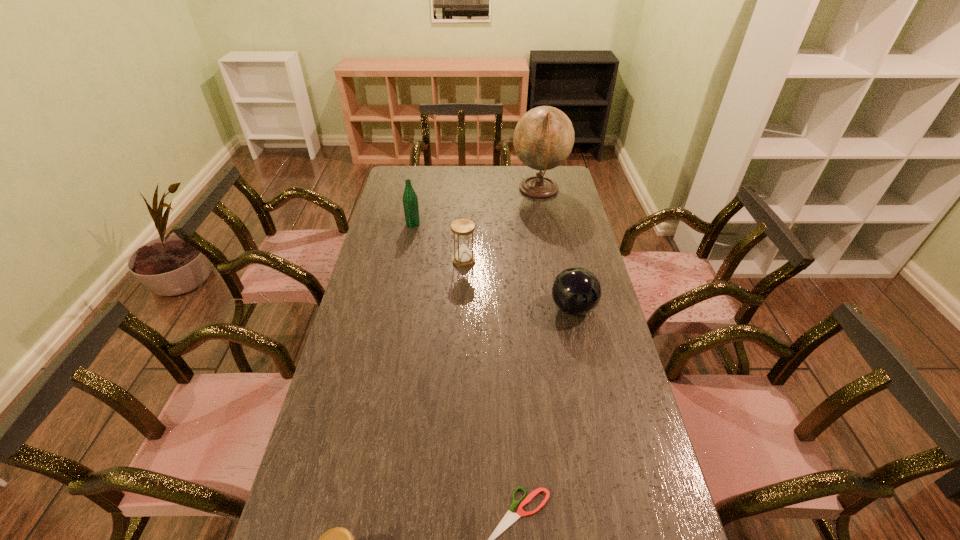
Image resolution: width=960 pixels, height=540 pixels. Find the location of `the tallest object`. the tallest object is located at coordinates (543, 138).

Where is `globe`? The width and height of the screenshot is (960, 540). globe is located at coordinates (543, 138).

Image resolution: width=960 pixels, height=540 pixels. I want to click on bottle, so click(410, 199).

The width and height of the screenshot is (960, 540). I want to click on the second farthest object, so click(x=410, y=199).

This screenshot has width=960, height=540. In order to click on the third object from left to right in this screenshot , I will do `click(462, 228)`.

You are a GUI agent. You are given a task and a screenshot of the screen. Output one action in this format:
    pyautogui.click(x=<x>, y=<y>)
    Task: Click on the hourglass
    The height and width of the screenshot is (540, 960).
    Given the screenshot: What is the action you would take?
    pyautogui.click(x=462, y=228)

You are a GUI agent. You are given a task and a screenshot of the screen. Output one action in this format:
    pyautogui.click(x=<x>, y=<y>)
    Task: Click on the bowling ball
    
    Given the screenshot: What is the action you would take?
    pyautogui.click(x=576, y=291)

Find the location of a particular element. free point located on the front-facing side of the farthest object is located at coordinates (437, 190).

Identify the location of free space located on the front-facing side of the farthest object. The image size is (960, 540). (492, 190).

Where is `vacant space located on the front-facing side of the farthest object`? vacant space located on the front-facing side of the farthest object is located at coordinates (442, 190).